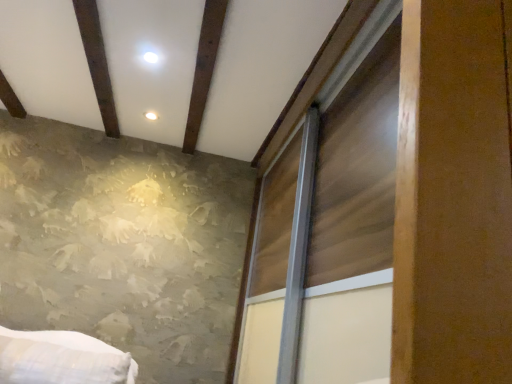
Question: In the image, is wooden sliding door at right positioned in front of or behind brown wooden plank at upper center?

Choices:
 (A) behind
 (B) front

Answer: (B)

Question: From the image's perspective, relative to brown wooden plank at upper center, is wooden sliding door at right above or below?

Choices:
 (A) above
 (B) below

Answer: (B)

Question: Considering the relative positions of wooden sliding door at right and brown wooden plank at upper center in the image provided, is wooden sliding door at right to the left or to the right of brown wooden plank at upper center?

Choices:
 (A) right
 (B) left

Answer: (A)

Question: In the image, is brown wooden plank at upper center on the left side or the right side of wooden sliding door at right?

Choices:
 (A) right
 (B) left

Answer: (B)

Question: Considering their positions, is brown wooden plank at upper center located in front of or behind wooden sliding door at right?

Choices:
 (A) behind
 (B) front

Answer: (A)

Question: From a real-world perspective, is brown wooden plank at upper center above or below wooden sliding door at right?

Choices:
 (A) above
 (B) below

Answer: (A)

Question: From the image's perspective, is brown wooden plank at upper center positioned above or below wooden sliding door at right?

Choices:
 (A) above
 (B) below

Answer: (A)